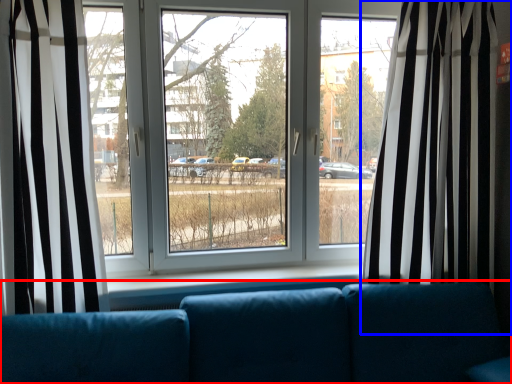
Question: Among these objects, which one is nearest to the camera, studio couch (highlighted by a red box) or curtain (highlighted by a blue box)?

Choices:
 (A) studio couch
 (B) curtain

Answer: (A)